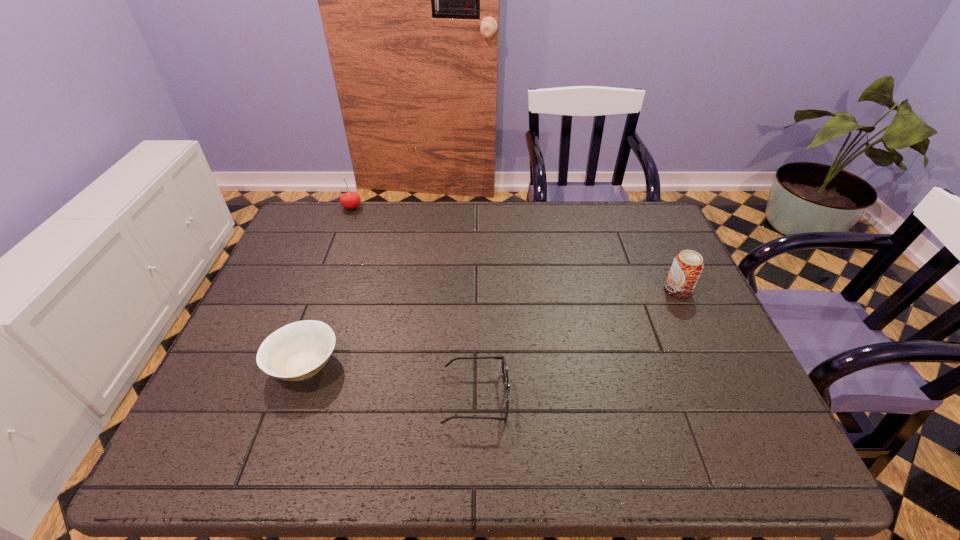
This screenshot has height=540, width=960. In the image, there is a desktop. In order to click on free space at the far right corner in this screenshot , I will do `click(614, 204)`.

Image resolution: width=960 pixels, height=540 pixels. Find the location of `free space between the third tallest object and the farthest object`. free space between the third tallest object and the farthest object is located at coordinates pyautogui.click(x=328, y=286).

What are the coordinates of `empty space between the second object from right to left and the cherry` in the screenshot? It's located at (414, 302).

Locate an element on the screen. free space between the beer can and the cherry is located at coordinates point(515,248).

Where is `vacant space that is in between the beer can and the farthest object`? This screenshot has width=960, height=540. vacant space that is in between the beer can and the farthest object is located at coordinates (515, 248).

Image resolution: width=960 pixels, height=540 pixels. What are the coordinates of `vacant point located between the rightmost object and the cherry` in the screenshot? It's located at (515, 248).

This screenshot has height=540, width=960. What are the coordinates of `free space between the third nearest object and the bowl` in the screenshot? It's located at (492, 327).

Find the location of `vacant area that lies between the rightmost object and the cherry`. vacant area that lies between the rightmost object and the cherry is located at coordinates (515, 248).

Find the location of a particular element. free area in between the spectacles and the bowl is located at coordinates (390, 381).

The height and width of the screenshot is (540, 960). What are the coordinates of `vacant area between the third tallest object and the shortest object` in the screenshot? It's located at (390, 381).